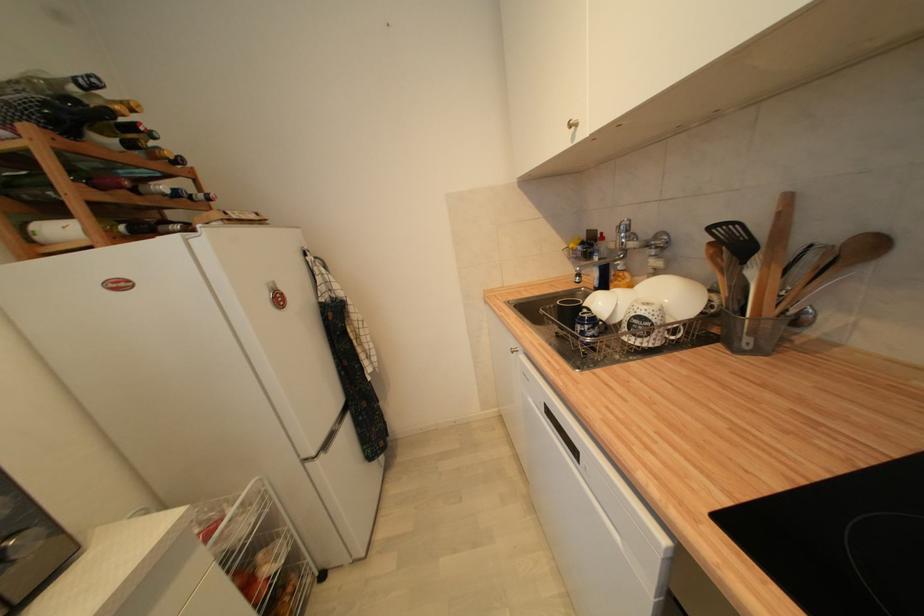
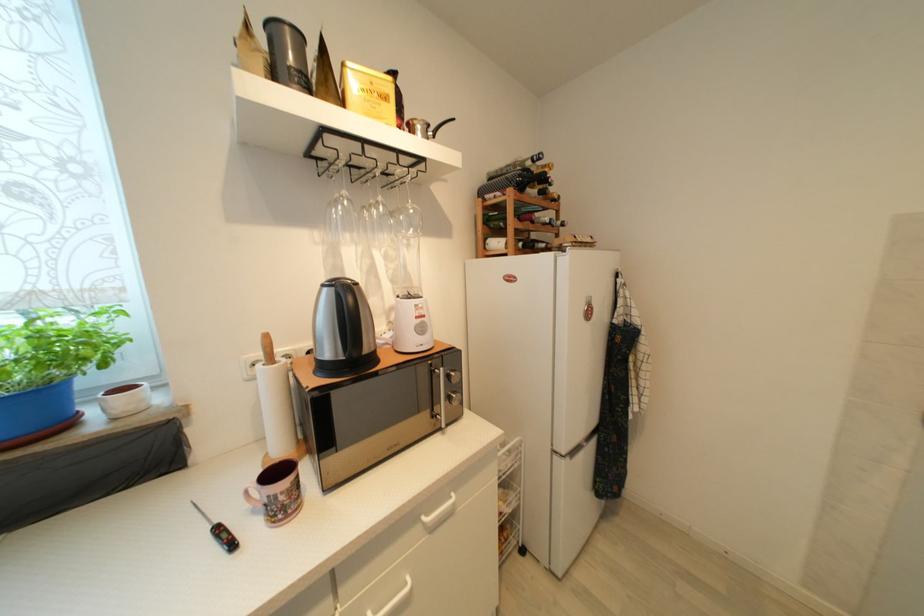
The point at (101, 139) is marked in the first image. Where is the corresponding point in the second image?

(533, 192)